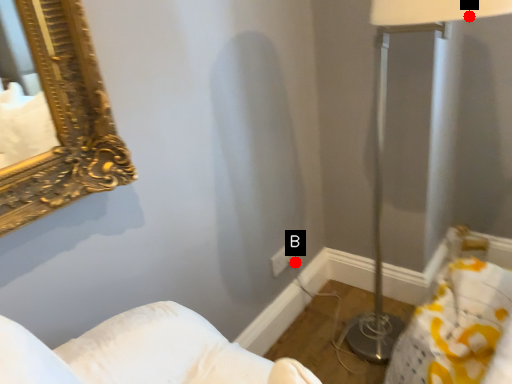
Question: Two points are circled on the image, labeled by A and B beside each circle. Which of the following is the closest to the observer?

Choices:
 (A) A is closer
 (B) B is closer

Answer: (A)